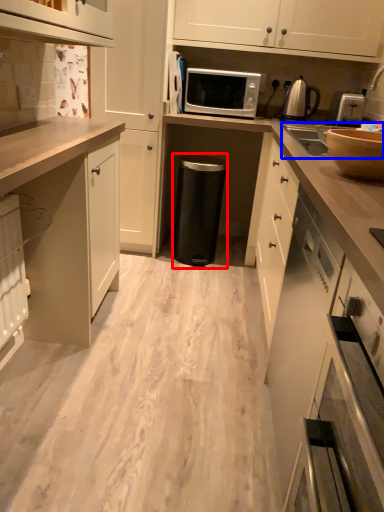
Question: Which point is closer to the camera, appliance (highlighted by a red box) or sink (highlighted by a blue box)?

Choices:
 (A) appliance
 (B) sink

Answer: (B)